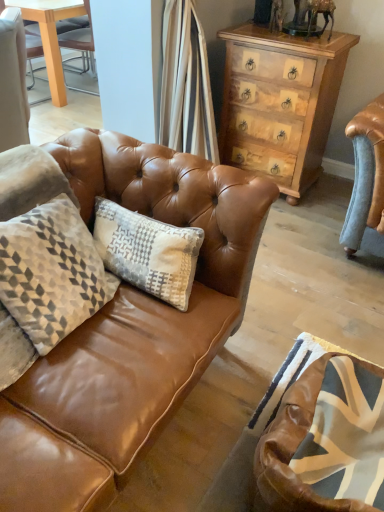
Question: Considering the positions of light brown wood chest of drawers at upper right and matte brown leather couch at center in the image, is light brown wood chest of drawers at upper right taller or shorter than matte brown leather couch at center?

Choices:
 (A) short
 (B) tall

Answer: (B)

Question: From a real-world perspective, relative to matte brown leather couch at center, is light brown wood chest of drawers at upper right vertically above or below?

Choices:
 (A) below
 (B) above

Answer: (B)

Question: Which object is the farthest from the brown leather swivel chair at lower right?

Choices:
 (A) matte brown leather couch at center
 (B) light brown wood chest of drawers at upper right

Answer: (B)

Question: Which object is the closest to the light brown wood chest of drawers at upper right?

Choices:
 (A) matte brown leather couch at center
 (B) brown leather swivel chair at lower right

Answer: (A)